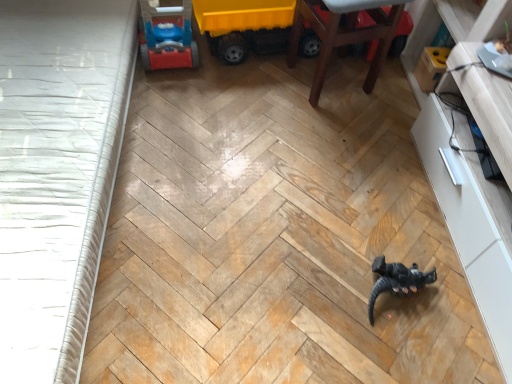
This screenshot has width=512, height=384. What are the coordinates of `vacant space in between wooden chair at upper right and yellow plastic toy truck at upper center, which is the 2th toy in right-to-left order` in the screenshot? It's located at (261, 81).